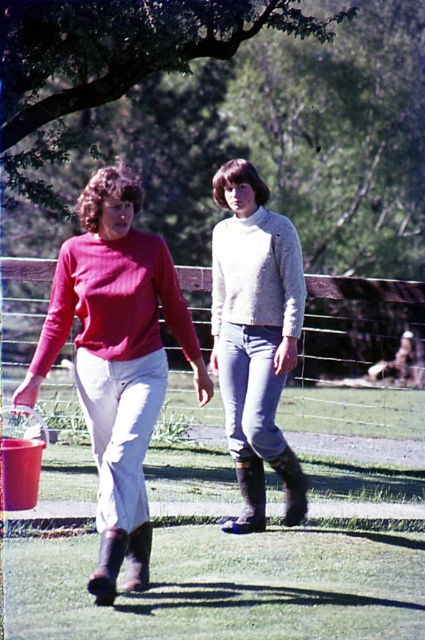
You are standing at the point marked by the coordinate point at (87, 301). You want to walk towards the two people in the image. How far will you have to walk to reach them?

The point at (87, 301) is 7.23 meters away from the viewer, so you will have to walk 7.23 meters to reach the two people.

You are standing in the park and see two people walking ahead of you. One is wearing a matte red sweater at left, and the other has a light gray sweater at center. Which person is closer to you?

The matte red sweater at left is closer to the viewer than the light gray sweater at center, so the person in the matte red sweater at left is closer to you.

You are a fashion designer observing two people in an image. You notice the matte red sweater at left and the light gray sweater at center. Which sweater would you recommend to a client who prefers a more voluminous style?

The matte red sweater at left has a larger size compared to the light gray sweater at center, so it would be the better choice for someone seeking a voluminous style.